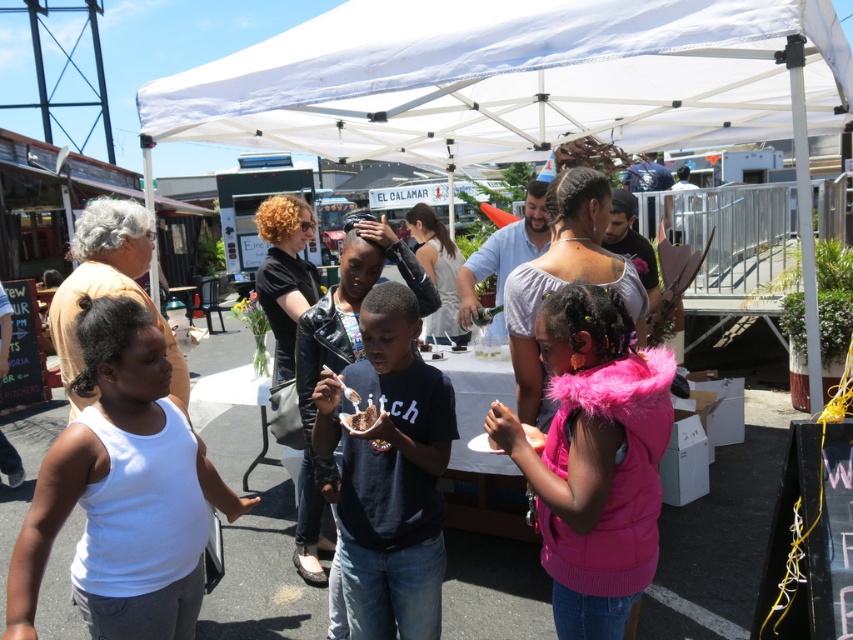
Question: Is white fabric canopy at upper center thinner than chocolate cake at center?

Choices:
 (A) yes
 (B) no

Answer: (B)

Question: Does white fabric canopy at upper center lie behind black matte shirt at center?

Choices:
 (A) no
 (B) yes

Answer: (B)

Question: Which is farther from the chocolate cake at center?

Choices:
 (A) black matte shirt at center
 (B) white fabric canopy at upper center

Answer: (B)

Question: Among these points, which one is nearest to the camera?

Choices:
 (A) (253, 81)
 (B) (347, 417)
 (C) (392, 442)

Answer: (C)

Question: Which of the following is the farthest from the observer?

Choices:
 (A) coord(352,419)
 (B) coord(349,540)

Answer: (B)

Question: Does black matte shirt at center have a larger size compared to chocolate cake at center?

Choices:
 (A) yes
 (B) no

Answer: (A)